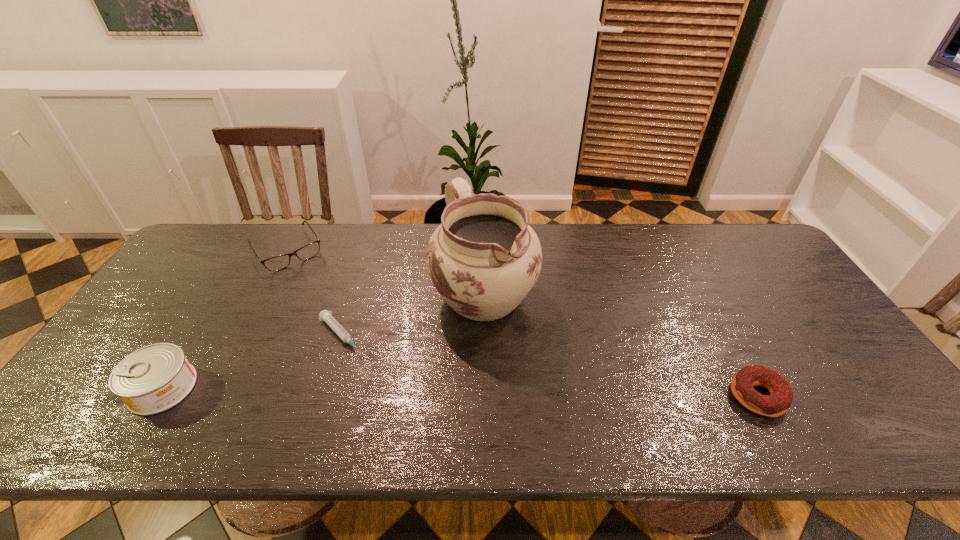
The height and width of the screenshot is (540, 960). I want to click on can at the near edge, so click(x=153, y=379).

Identify the location of doughnut present at the near edge. This screenshot has height=540, width=960. (781, 395).

Where is `object located at the left edge`? object located at the left edge is located at coordinates [x=153, y=379].

I want to click on object at the near left corner, so click(x=153, y=379).

In the image, there is a desktop. Where is `blank space at the far edge`? Image resolution: width=960 pixels, height=540 pixels. blank space at the far edge is located at coordinates (569, 231).

At what (x,y) coordinates should I click in order to perform the action: click on blank space at the near edge of the desktop. Please return your answer as a coordinate pair (x, y). This screenshot has height=540, width=960. Looking at the image, I should click on (497, 387).

Where is `free space at the left edge of the desktop`? This screenshot has height=540, width=960. free space at the left edge of the desktop is located at coordinates (196, 314).

Locate an element on the screen. This screenshot has height=540, width=960. blank space at the right edge is located at coordinates (773, 276).

Find the location of a particular element. The height and width of the screenshot is (540, 960). free space at the far left corner of the desktop is located at coordinates (231, 248).

Find the location of a particular element. The image size is (960, 540). vacant region at the near right corner of the desktop is located at coordinates (822, 383).